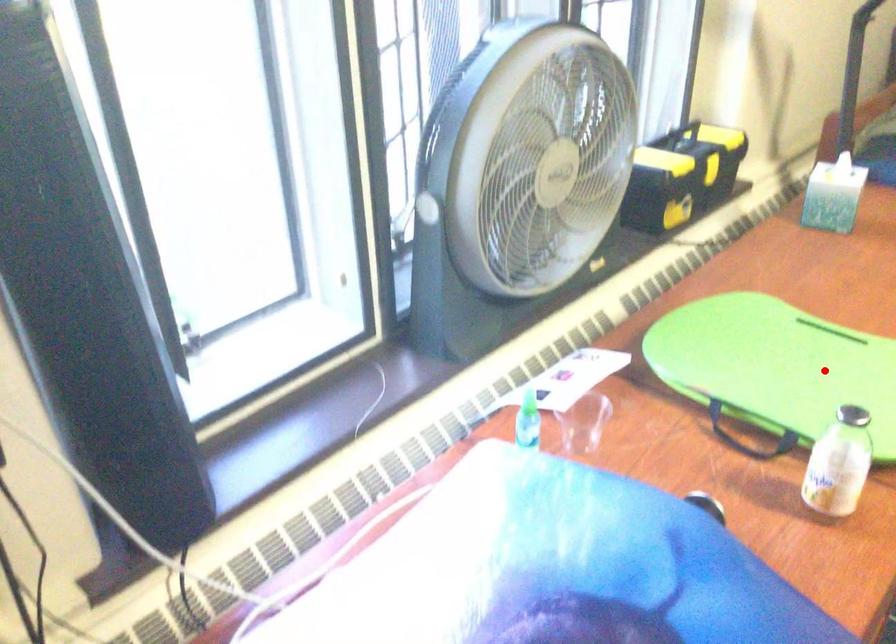
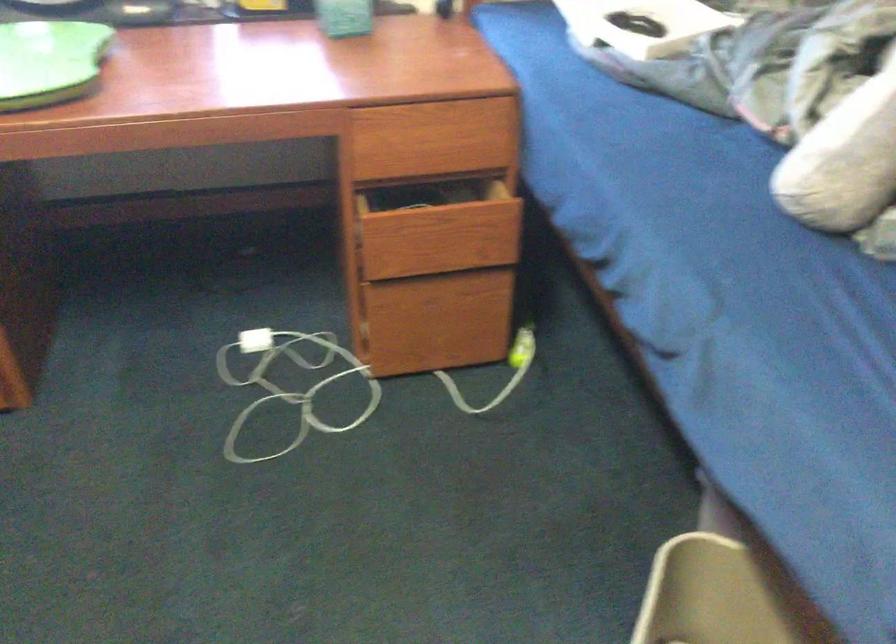
Where in the second image is the point corresponding to the highlighted location from the first image?

(49, 62)